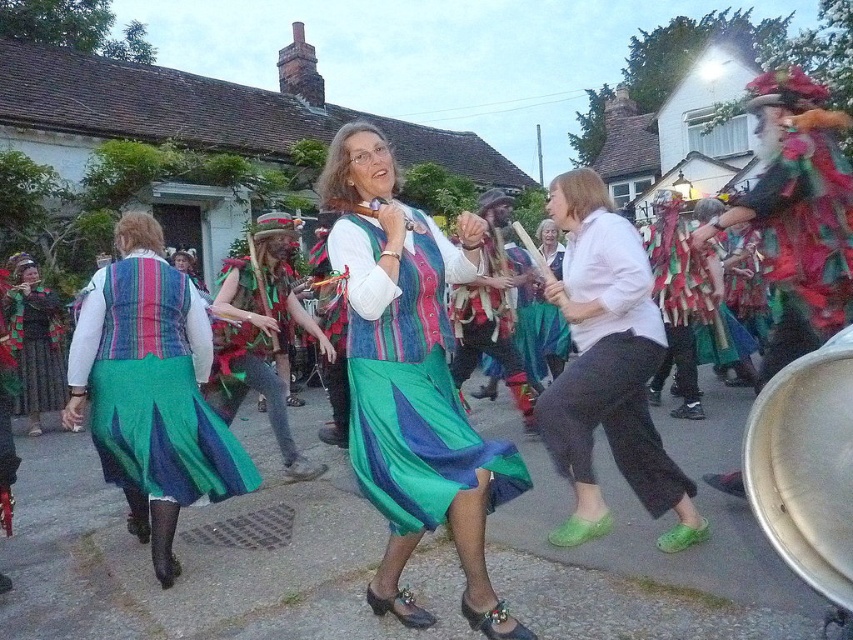
Image resolution: width=853 pixels, height=640 pixels. What do you see at coordinates (151, 390) in the screenshot?
I see `denim vest at center` at bounding box center [151, 390].

Who is more distant from viewer, (77, 342) or (245, 340)?

The point (245, 340) is more distant.

Find the location of a particular element. Image resolution: width=853 pixels, height=640 pixels. denim vest at center is located at coordinates (151, 390).

Can you confirm if white cotton shirt at center is smaller than green textured skirt at left?

Yes.

Can you confirm if white cotton shirt at center is bigger than green textured skirt at left?

Actually, white cotton shirt at center might be smaller than green textured skirt at left.

What do you see at coordinates (608, 365) in the screenshot? I see `white cotton shirt at center` at bounding box center [608, 365].

Where is `white cotton shirt at center`? Image resolution: width=853 pixels, height=640 pixels. white cotton shirt at center is located at coordinates (608, 365).

Can you confirm if denim vest at center is taller than green textured skirt at left?

Yes.

Who is more forward, (x=144, y=476) or (x=47, y=333)?

Point (x=144, y=476)

Which is in front, point (138, 339) or point (16, 307)?

Positioned in front is point (138, 339).

The height and width of the screenshot is (640, 853). What are the coordinates of `denim vest at center` in the screenshot? It's located at pos(151,390).